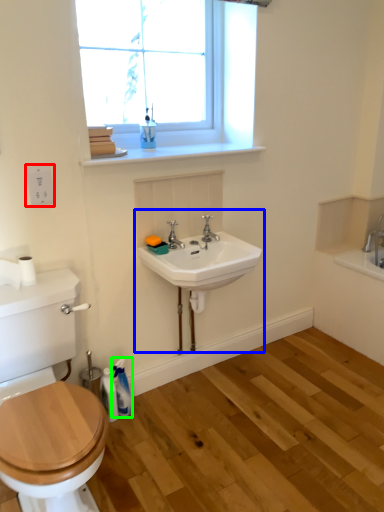
Question: Estimate the real-world distances between objects in this image. Which object is closer to electric outlet (highlighted by a red box), sink (highlighted by a blue box) or toiletry (highlighted by a green box)?

Choices:
 (A) sink
 (B) toiletry

Answer: (A)